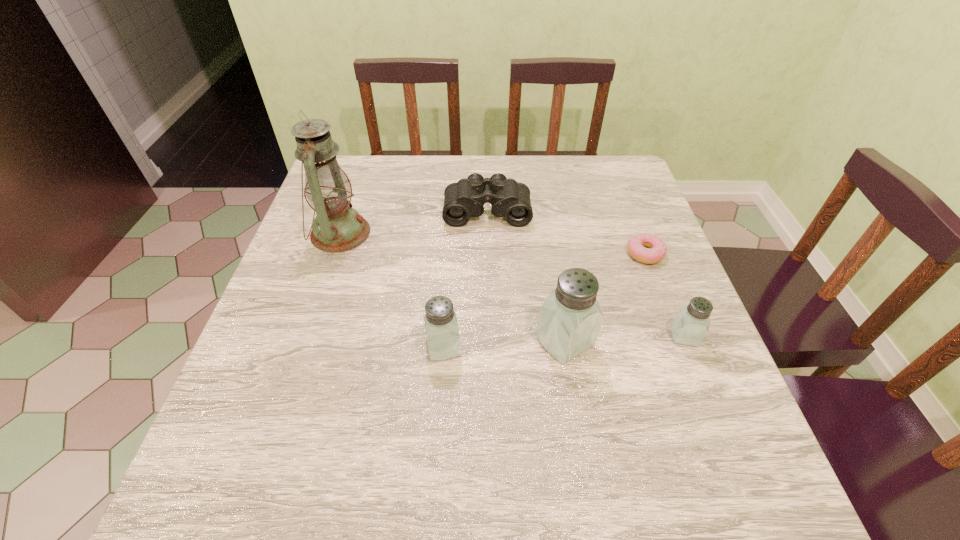
The width and height of the screenshot is (960, 540). Identify the location of the fourth shortest object. (441, 327).

Find the location of a particular element. The height and width of the screenshot is (540, 960). the second shortest saltshaker is located at coordinates (441, 327).

The width and height of the screenshot is (960, 540). I want to click on the tallest saltshaker, so click(570, 318).

The width and height of the screenshot is (960, 540). I want to click on the second saltshaker from left to right, so click(x=570, y=318).

This screenshot has width=960, height=540. I want to click on the rightmost saltshaker, so click(691, 324).

The width and height of the screenshot is (960, 540). I want to click on binoculars, so click(463, 199).

At what (x,y) coordinates should I click in order to perform the action: click on the tallest object. Please return your answer as a coordinate pair (x, y). Looking at the image, I should click on (338, 227).

Where is `oil lamp`? oil lamp is located at coordinates (338, 227).

Identify the location of the shortest object. The height and width of the screenshot is (540, 960). (636, 245).

Locate an element on the screen. This screenshot has height=540, width=960. blank area located 0.350m on the back of the fourth shortest object is located at coordinates (452, 224).